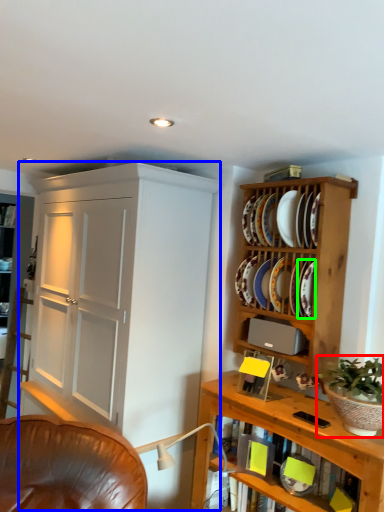
Question: Which is farther away from houseplant (highlighted by a red box)? cupboard (highlighted by a blue box) or platter (highlighted by a green box)?

Choices:
 (A) cupboard
 (B) platter

Answer: (A)